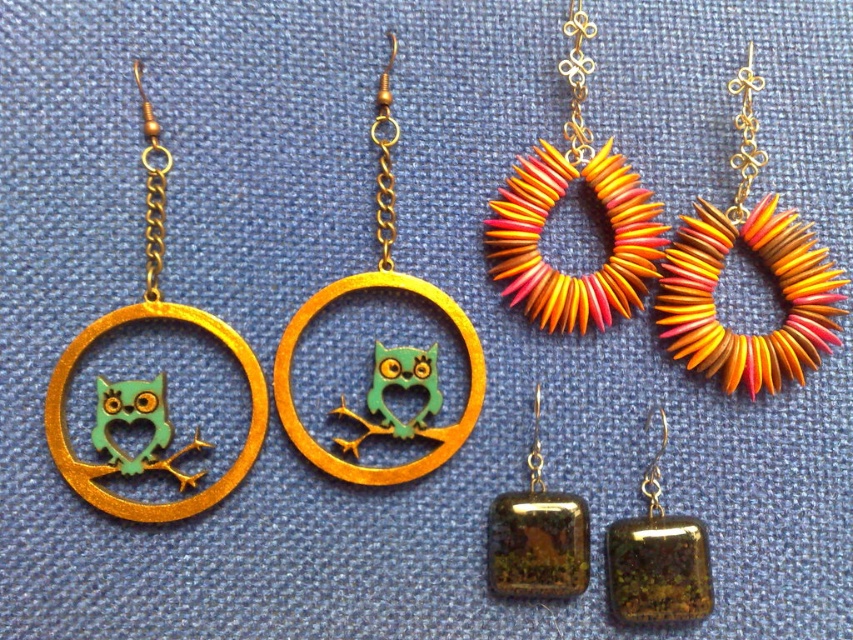
You are a customer at a jewelry store and want to wear both the orange and yellow beaded hoop at upper center and the gold textured square at bottom right as earrings. Can you determine which earring has a larger width?

The orange and yellow beaded hoop at upper center might be wider than gold textured square at bottom right, so it is possible that the orange and yellow beaded hoop at upper center has a larger width.

You are a customer at a jewelry store looking to buy earrings. You see the orange and yellow beaded hoop at upper center and the green matte owl at center. Which earring is taller?

The orange and yellow beaded hoop at upper center is taller than the green matte owl at center.

You are examining two points on the earrings displayed on the blue fabric. The first point is at coordinates point (556, 160) and the second is at point (404, 368). Which point is closer to you?

Point (556, 160) is further to the camera than point (404, 368), so the point closer to you is point (404, 368).